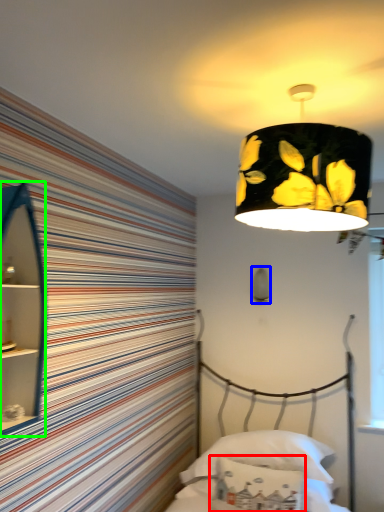
Question: Which object is the closest to the pillow (highlighted by a red box)? Choose among these: lamp (highlighted by a blue box) or cabinet (highlighted by a green box).

Choices:
 (A) lamp
 (B) cabinet

Answer: (A)